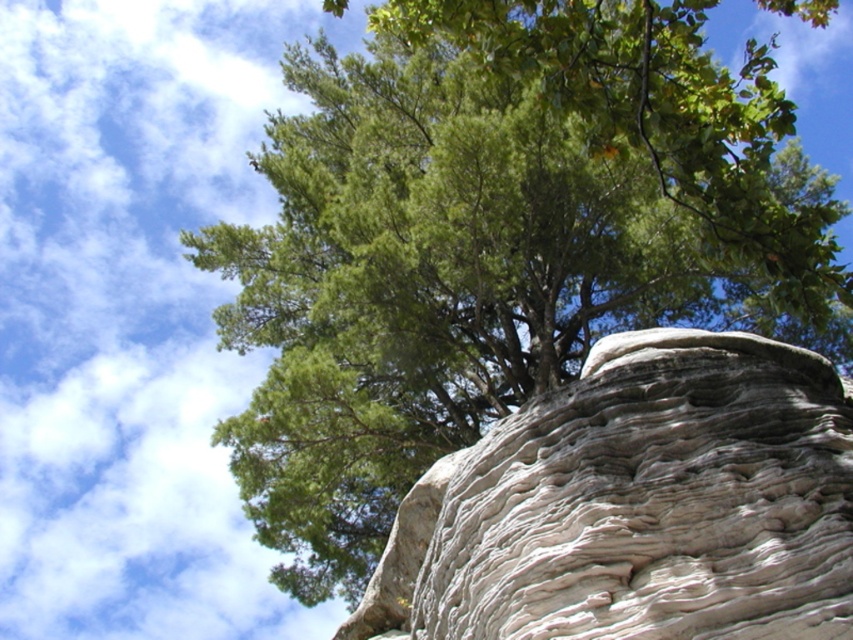
You are standing in front of the large tree and want to place a small statue on the rock to your right. Is the white textured rock at center located to the right of the green leafy tree at upper center?

The white textured rock at center is to the left of the green leafy tree at upper center, so it is not to the right of the tree. Therefore, the statue should be placed on a different rock to your right side.

You are a hiker who wants to take a photo of the green leafy tree at upper center. To get a clear shot of the tree without the white textured rock at center blocking it, where should you position yourself relative to the tree?

To avoid the white textured rock at center blocking the view of the green leafy tree at upper center, you should position yourself behind the tree so that the rock is out of the frame or obscured by the tree itself.